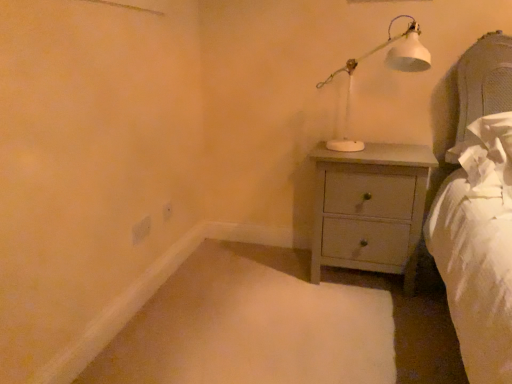
This screenshot has height=384, width=512. What do you see at coordinates (141, 230) in the screenshot?
I see `white matte electric outlet at lower left, acting as the second electric outlet starting from the right` at bounding box center [141, 230].

Identify the location of light gray wood chest of drawers at center-right. This screenshot has width=512, height=384. (370, 208).

You are a GUI agent. You are given a task and a screenshot of the screen. Output one action in this format:
    pyautogui.click(x=<x>, y=<y>)
    Task: Click on the white matte electric outlet at lower left, which is counted as the first electric outlet, starting from the left
    This screenshot has width=512, height=384.
    Given the screenshot: What is the action you would take?
    pyautogui.click(x=141, y=230)

Who is bigger, white matte electric outlet at lower left, marked as the second electric outlet in a back-to-front arrangement, or white plastic electric outlet at lower center, the 1th electric outlet viewed from the right?

With larger size is white matte electric outlet at lower left, marked as the second electric outlet in a back-to-front arrangement.

Is point (132, 241) closer or farther from the camera than point (170, 209)?

Clearly, point (132, 241) is closer to the camera than point (170, 209).

Which object is closer to the camera, white matte electric outlet at lower left, marked as the second electric outlet in a back-to-front arrangement, or white plastic electric outlet at lower center, which is the second electric outlet in front-to-back order?

white matte electric outlet at lower left, marked as the second electric outlet in a back-to-front arrangement, is more forward.

How different are the orientations of white matte electric outlet at lower left, which is counted as the first electric outlet, starting from the left, and white plastic electric outlet at lower center, which is the second electric outlet in front-to-back order, in degrees?

2.09 degrees separate the facing orientations of white matte electric outlet at lower left, which is counted as the first electric outlet, starting from the left, and white plastic electric outlet at lower center, which is the second electric outlet in front-to-back order.

Looking at this image, from a real-world perspective, who is located higher, white plastic electric outlet at lower center, placed as the 2th electric outlet when sorted from left to right, or white matte table lamp at upper right?

In real-world perspective, white matte table lamp at upper right is above.

Is white plastic electric outlet at lower center, the 1th electric outlet viewed from the right, bigger or smaller than white matte table lamp at upper right?

Clearly, white plastic electric outlet at lower center, the 1th electric outlet viewed from the right, is smaller in size than white matte table lamp at upper right.

Measure the distance from white plastic electric outlet at lower center, which is the second electric outlet in front-to-back order, to white matte table lamp at upper right.

They are 3.85 feet apart.

Which is more to the right, white plastic electric outlet at lower center, the 1th electric outlet viewed from the right, or white matte table lamp at upper right?

From the viewer's perspective, white matte table lamp at upper right appears more on the right side.

Who is smaller, white plastic electric outlet at lower center, the 1th electric outlet from the back, or white matte electric outlet at lower left, acting as the second electric outlet starting from the right?

With smaller size is white plastic electric outlet at lower center, the 1th electric outlet from the back.

Which is correct: white plastic electric outlet at lower center, which is the second electric outlet in front-to-back order, is inside white matte electric outlet at lower left, which is counted as the first electric outlet, starting from the left, or outside of it?

white plastic electric outlet at lower center, which is the second electric outlet in front-to-back order, is outside white matte electric outlet at lower left, which is counted as the first electric outlet, starting from the left.

Which object is more forward, white plastic electric outlet at lower center, which is the second electric outlet in front-to-back order, or white matte electric outlet at lower left, acting as the second electric outlet starting from the right?

Positioned in front is white matte electric outlet at lower left, acting as the second electric outlet starting from the right.

What's the angular difference between white matte table lamp at upper right and light gray wood chest of drawers at center-right's facing directions?

The angular difference between white matte table lamp at upper right and light gray wood chest of drawers at center-right is 0.633 degrees.

Find the location of a particular element. This screenshot has width=512, height=384. table lamp on the left of the light gray wood chest of drawers at center-right is located at coordinates (388, 66).

Is light gray wood chest of drawers at center-right a part of white matte table lamp at upper right?

Definitely not — light gray wood chest of drawers at center-right is not inside white matte table lamp at upper right.

From a real-world perspective, which object stands above the other?

From a 3D spatial view, white matte table lamp at upper right is above.

Which is more to the right, white matte table lamp at upper right or white matte electric outlet at lower left, which is counted as the first electric outlet, starting from the left?

white matte table lamp at upper right.

Is white matte table lamp at upper right closer to the viewer compared to white matte electric outlet at lower left, acting as the second electric outlet starting from the right?

Yes, the depth of white matte table lamp at upper right is less than that of white matte electric outlet at lower left, acting as the second electric outlet starting from the right.

Looking at this image, looking at their sizes, would you say white matte table lamp at upper right is wider or thinner than white matte electric outlet at lower left, marked as the second electric outlet in a back-to-front arrangement?

Clearly, white matte table lamp at upper right has more width compared to white matte electric outlet at lower left, marked as the second electric outlet in a back-to-front arrangement.

Considering the relative positions of white matte electric outlet at lower left, acting as the first electric outlet starting from the front, and light gray wood chest of drawers at center-right in the image provided, is white matte electric outlet at lower left, acting as the first electric outlet starting from the front, in front of light gray wood chest of drawers at center-right?

No.

Can you confirm if white matte electric outlet at lower left, acting as the second electric outlet starting from the right, is wider than light gray wood chest of drawers at center-right?

Incorrect, the width of white matte electric outlet at lower left, acting as the second electric outlet starting from the right, does not surpass that of light gray wood chest of drawers at center-right.

The width and height of the screenshot is (512, 384). I want to click on the chest of drawers directly beneath the white matte electric outlet at lower left, marked as the second electric outlet in a back-to-front arrangement (from a real-world perspective), so click(370, 208).

From the image's perspective, who appears lower, white matte electric outlet at lower left, acting as the second electric outlet starting from the right, or light gray wood chest of drawers at center-right?

white matte electric outlet at lower left, acting as the second electric outlet starting from the right, appears lower in the image.

Is light gray wood chest of drawers at center-right thinner than white plastic electric outlet at lower center, placed as the 2th electric outlet when sorted from left to right?

No, light gray wood chest of drawers at center-right is not thinner than white plastic electric outlet at lower center, placed as the 2th electric outlet when sorted from left to right.

Is light gray wood chest of drawers at center-right bigger or smaller than white plastic electric outlet at lower center, which is the second electric outlet in front-to-back order?

Considering their sizes, light gray wood chest of drawers at center-right takes up more space than white plastic electric outlet at lower center, which is the second electric outlet in front-to-back order.

Which of these two, light gray wood chest of drawers at center-right or white plastic electric outlet at lower center, placed as the 2th electric outlet when sorted from left to right, stands taller?

With more height is light gray wood chest of drawers at center-right.

Is light gray wood chest of drawers at center-right facing away from white plastic electric outlet at lower center, which is the second electric outlet in front-to-back order?

No.

In order to click on electric outlet directly beneath the white matte electric outlet at lower left, marked as the second electric outlet in a back-to-front arrangement (from a real-world perspective) in this screenshot , I will do (x=167, y=211).

From the white matte table lamp at upper right, count the 1st electric outlet to the left and point to it. Please provide its 2D coordinates.

[(167, 211)]

Estimate the real-world distances between objects in this image. Which object is closer to white matte electric outlet at lower left, acting as the first electric outlet starting from the front, light gray wood chest of drawers at center-right or white matte table lamp at upper right?

The object closer to white matte electric outlet at lower left, acting as the first electric outlet starting from the front, is light gray wood chest of drawers at center-right.

From the picture: Estimate the real-world distances between objects in this image. Which object is further from white matte table lamp at upper right, white matte electric outlet at lower left, marked as the second electric outlet in a back-to-front arrangement, or light gray wood chest of drawers at center-right?

Answer: The object further to white matte table lamp at upper right is white matte electric outlet at lower left, marked as the second electric outlet in a back-to-front arrangement.

Considering their positions, is white plastic electric outlet at lower center, the 1th electric outlet viewed from the right, positioned closer to light gray wood chest of drawers at center-right than white matte table lamp at upper right?

Among the two, white matte table lamp at upper right is located nearer to light gray wood chest of drawers at center-right.

Considering their positions, is white plastic electric outlet at lower center, placed as the 2th electric outlet when sorted from left to right, positioned closer to light gray wood chest of drawers at center-right than white matte electric outlet at lower left, acting as the second electric outlet starting from the right?

white plastic electric outlet at lower center, placed as the 2th electric outlet when sorted from left to right.

From the image, which object appears to be farther from white matte table lamp at upper right, white plastic electric outlet at lower center, the 1th electric outlet from the back, or light gray wood chest of drawers at center-right?

white plastic electric outlet at lower center, the 1th electric outlet from the back, is positioned further to the anchor white matte table lamp at upper right.

Based on their spatial positions, is white matte electric outlet at lower left, marked as the second electric outlet in a back-to-front arrangement, or white plastic electric outlet at lower center, placed as the 2th electric outlet when sorted from left to right, closer to light gray wood chest of drawers at center-right?

Based on the image, white plastic electric outlet at lower center, placed as the 2th electric outlet when sorted from left to right, appears to be nearer to light gray wood chest of drawers at center-right.

Based on their spatial positions, is white matte electric outlet at lower left, which is counted as the first electric outlet, starting from the left, or white matte table lamp at upper right closer to light gray wood chest of drawers at center-right?

Based on the image, white matte table lamp at upper right appears to be nearer to light gray wood chest of drawers at center-right.

When comparing their distances from white matte table lamp at upper right, does light gray wood chest of drawers at center-right or white matte electric outlet at lower left, acting as the second electric outlet starting from the right, seem further?

white matte electric outlet at lower left, acting as the second electric outlet starting from the right, lies further to white matte table lamp at upper right than the other object.

Identify the location of electric outlet between white matte electric outlet at lower left, marked as the second electric outlet in a back-to-front arrangement, and light gray wood chest of drawers at center-right from left to right. (167, 211).

Image resolution: width=512 pixels, height=384 pixels. Identify the location of table lamp between white plastic electric outlet at lower center, the 1th electric outlet from the back, and light gray wood chest of drawers at center-right. (388, 66).

Where is `electric outlet between white matte electric outlet at lower left, which is counted as the first electric outlet, starting from the left, and white matte table lamp at upper right, in the horizontal direction`? electric outlet between white matte electric outlet at lower left, which is counted as the first electric outlet, starting from the left, and white matte table lamp at upper right, in the horizontal direction is located at coordinates (167, 211).

In order to click on table lamp between white matte electric outlet at lower left, acting as the first electric outlet starting from the front, and light gray wood chest of drawers at center-right from left to right in this screenshot , I will do `click(388, 66)`.